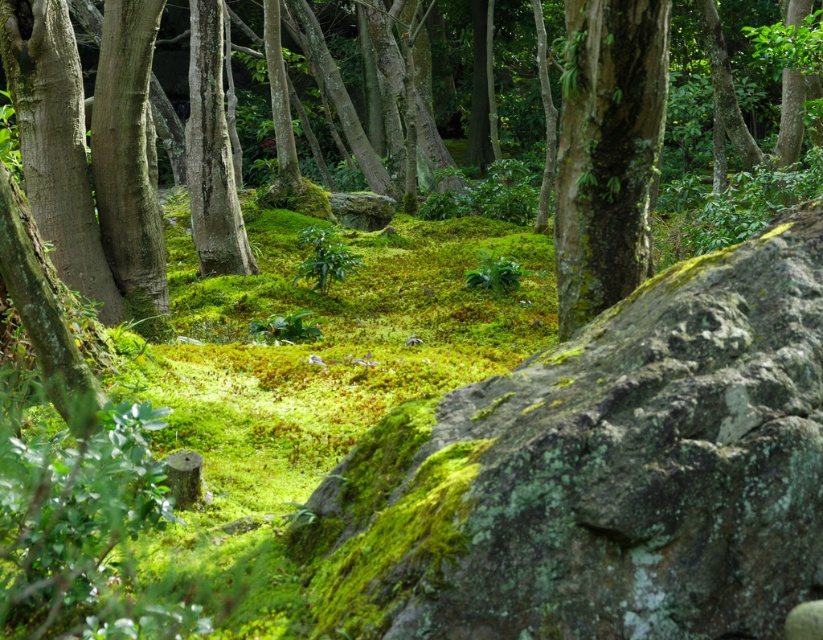
Does smooth brown bark at left have a lesser width compared to smooth bark tree trunk at center-left?

Indeed, smooth brown bark at left has a lesser width compared to smooth bark tree trunk at center-left.

Does point (136, 168) come behind point (198, 72)?

No, it is in front of (198, 72).

Locate an element on the screen. This screenshot has width=823, height=640. smooth brown bark at left is located at coordinates (128, 163).

Find the location of a particular element. smooth brown bark at left is located at coordinates click(x=128, y=163).

Identify the location of green mossy bark at center. (607, 150).

Is point (591, 170) positioned before point (119, 99)?

Yes, point (591, 170) is closer to viewer.

Where is `green mossy bark at center`? green mossy bark at center is located at coordinates pos(607,150).

Describe the element at coordinates (54, 144) in the screenshot. I see `green mossy bark at left` at that location.

Identify the location of green mossy bark at left. (54, 144).

The width and height of the screenshot is (823, 640). I want to click on green mossy bark at left, so click(54, 144).